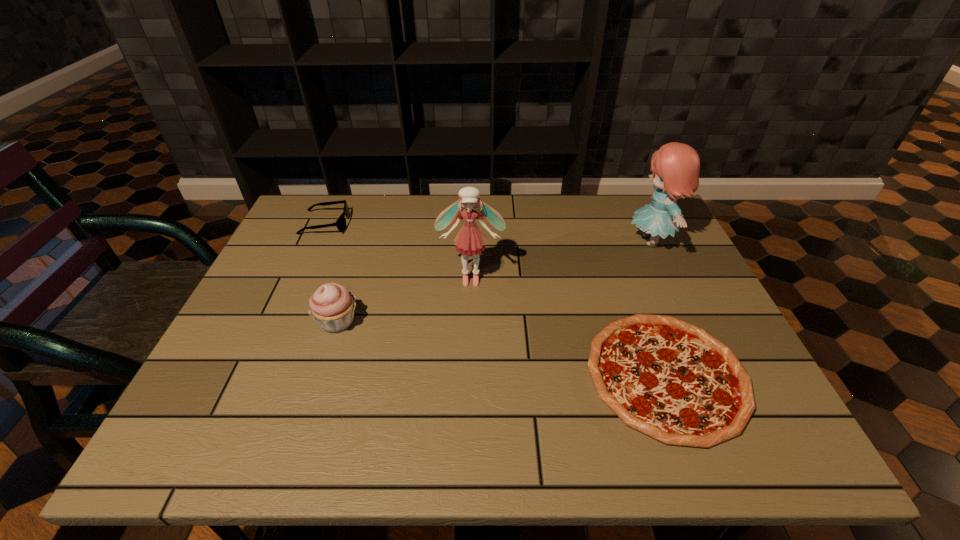
Find the location of a particular element. This screenshot has height=540, width=960. the third closest object relative to the cupcake is located at coordinates (671, 380).

The width and height of the screenshot is (960, 540). In order to click on vacant area in the image that satisfies the following two spatial constraints: 1. on the front-facing side of the pizza; 2. on the left side of the sunglasses in this screenshot , I will do 257,375.

The height and width of the screenshot is (540, 960). I want to click on free location that satisfies the following two spatial constraints: 1. on the front-facing side of the right doll; 2. on the front-facing side of the left doll, so click(669, 279).

The height and width of the screenshot is (540, 960). Find the location of `free region that satisfies the following two spatial constraints: 1. on the front-facing side of the pizza; 2. on the right side of the leftmost object`. free region that satisfies the following two spatial constraints: 1. on the front-facing side of the pizza; 2. on the right side of the leftmost object is located at coordinates (257, 375).

Locate an element on the screen. This screenshot has height=540, width=960. free space that satisfies the following two spatial constraints: 1. on the front-facing side of the fourth tallest object; 2. on the back side of the cupcake is located at coordinates (x=281, y=322).

You are a GUI agent. You are given a task and a screenshot of the screen. Output one action in this format:
    pyautogui.click(x=<x>, y=<y>)
    Task: Click on the vacant point that satisfies the following two spatial constraints: 1. on the front-facing side of the leftmost object; 2. on the right side of the third tallest object
    The width and height of the screenshot is (960, 540).
    Given the screenshot: What is the action you would take?
    pyautogui.click(x=281, y=322)